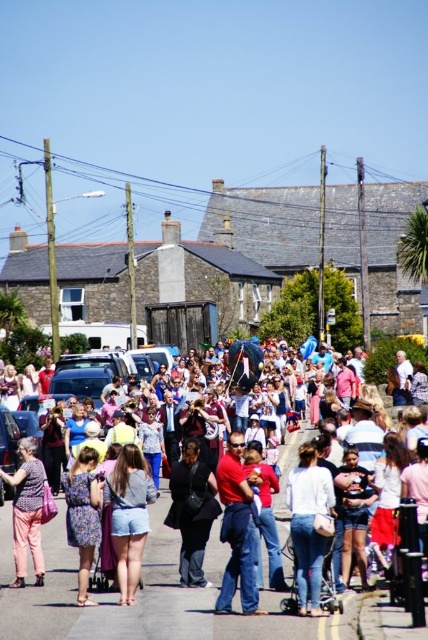
Who is lower down, white cotton crowd at center or dusty purple dress at lower left?

dusty purple dress at lower left is below.

You are a GUI agent. You are given a task and a screenshot of the screen. Output one action in this format:
    pyautogui.click(x=<x>, y=<y>)
    Task: Click on the white cotton crowd at center
    
    Given the screenshot: What is the action you would take?
    pyautogui.click(x=107, y=592)

Who is more distant from viewer, [168,582] or [74,474]?

Point [74,474]

I want to click on white cotton crowd at center, so click(107, 592).

This screenshot has width=428, height=640. Find the location of `white cotton shirt at center`. white cotton shirt at center is located at coordinates (309, 524).

Between point (305, 557) and point (234, 502), which one is positioned behind?

Positioned behind is point (234, 502).

I want to click on white cotton shirt at center, so click(309, 524).

Is black matte jacket at center thinner than floral fabric dress at lower left?

Indeed, black matte jacket at center has a lesser width compared to floral fabric dress at lower left.

Can you confirm if black matte jacket at center is taller than floral fabric dress at lower left?

No, black matte jacket at center is not taller than floral fabric dress at lower left.

What do you see at coordinates (192, 512) in the screenshot? I see `black matte jacket at center` at bounding box center [192, 512].

The width and height of the screenshot is (428, 640). In order to click on black matte jacket at center in this screenshot , I will do `click(192, 512)`.